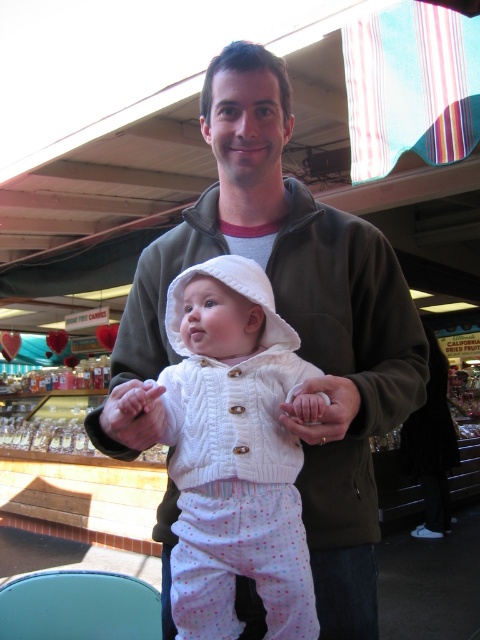
You are a clothing designer observing the scene and want to create a new line of layered outfits. Given the matte brown jacket at center and the white knitted sweater at center, which one would you suggest placing over the other to ensure proper visibility of both garments?

The matte brown jacket at center is bigger than the white knitted sweater at center, so to ensure visibility of both garments, the white knitted sweater at center should be worn under the matte brown jacket at center.

You are a photographer trying to capture the baby in the image. To ensure the baby stays focused on the camera, you need to place a toy near the white knitted sweater at center and the white soft baby hand at center. Which object should you place the toy closer to so the baby can easily reach it?

The white soft baby hand at center is smaller than the white knitted sweater at center, so placing the toy closer to the white soft baby hand at center would allow the baby to reach it more easily.

Looking at this image, you are a photographer trying to capture a closeup of the matte brown jacket at center and the white soft baby hand at center. Which object should you focus on first to ensure it appears sharp in the photo?

You should focus on the matte brown jacket at center first because it is closer to the viewer than the white soft baby hand at center, so it will be in focus before the hand.